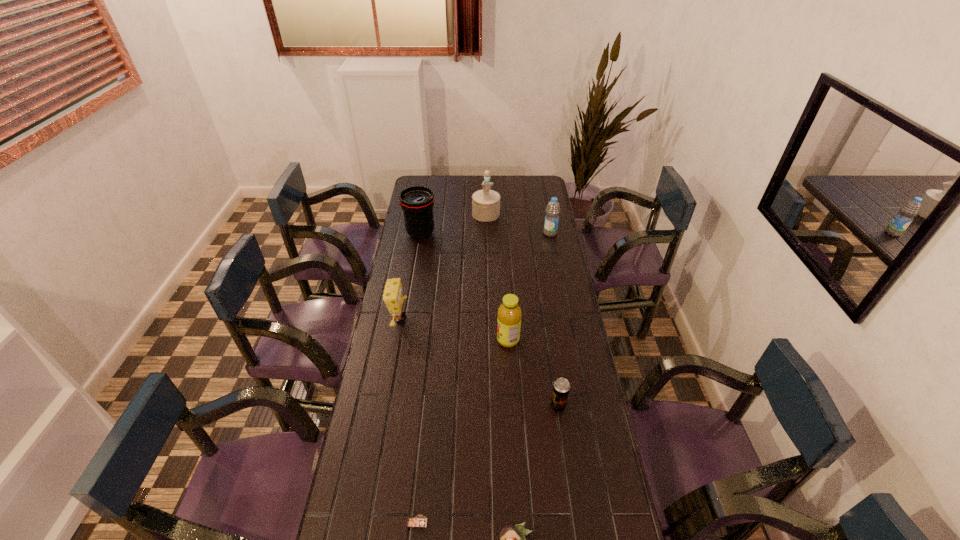
You are a GUI agent. You are given a task and a screenshot of the screen. Output one action in this format:
    pyautogui.click(x=<x>, y=<y>)
    Task: Click on the vacant area that satisfies the following two spatial constraints: 1. at the beak of the farthest object; 2. on the face of the sponge
    
    Given the screenshot: What is the action you would take?
    (x=488, y=319)